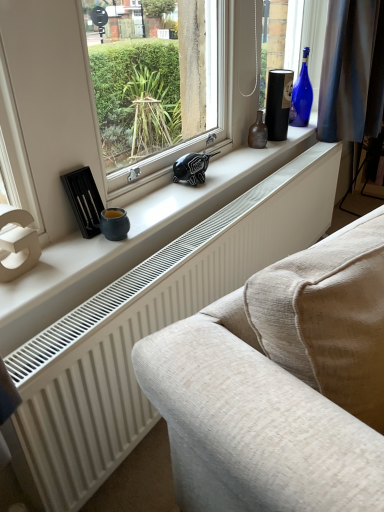
Question: Is blue glass bottle at upper right, the 2th bottle in the front-to-back sequence, at the right side of brown glass bottle at center, the 1th bottle in the left-to-right sequence?

Choices:
 (A) no
 (B) yes

Answer: (B)

Question: From a real-world perspective, is blue glass bottle at upper right, positioned as the first bottle in top-to-bottom order, beneath brown glass bottle at center, the 2th bottle in the back-to-front sequence?

Choices:
 (A) yes
 (B) no

Answer: (B)

Question: Considering the relative sizes of blue glass bottle at upper right, positioned as the first bottle in top-to-bottom order, and brown glass bottle at center, the 1th bottle in the left-to-right sequence, in the image provided, is blue glass bottle at upper right, positioned as the first bottle in top-to-bottom order, smaller than brown glass bottle at center, the 1th bottle in the left-to-right sequence,?

Choices:
 (A) no
 (B) yes

Answer: (A)

Question: Can you confirm if blue glass bottle at upper right, the 1th bottle in the back-to-front sequence, is positioned to the left of brown glass bottle at center, placed as the 1th bottle when sorted from bottom to top?

Choices:
 (A) no
 (B) yes

Answer: (A)

Question: Does blue glass bottle at upper right, the 2th bottle in the front-to-back sequence, contain brown glass bottle at center, arranged as the 2th bottle when viewed from the top?

Choices:
 (A) yes
 (B) no

Answer: (B)

Question: From the image's perspective, is brown glass bottle at center, the first bottle from the front, positioned above or below white matte window sill at center?

Choices:
 (A) below
 (B) above

Answer: (B)

Question: From a real-world perspective, relative to white matte window sill at center, is brown glass bottle at center, positioned as the second bottle in right-to-left order, vertically above or below?

Choices:
 (A) below
 (B) above

Answer: (B)

Question: Would you say brown glass bottle at center, arranged as the 2th bottle when viewed from the top, is to the left or to the right of white matte window sill at center in the picture?

Choices:
 (A) right
 (B) left

Answer: (A)

Question: In terms of width, does brown glass bottle at center, arranged as the 2th bottle when viewed from the top, look wider or thinner when compared to white matte window sill at center?

Choices:
 (A) thin
 (B) wide

Answer: (A)

Question: Considering the positions of white textured radiator at lower center and blue glass bottle at upper right, the 2th bottle in the front-to-back sequence, in the image, is white textured radiator at lower center taller or shorter than blue glass bottle at upper right, the 2th bottle in the front-to-back sequence,?

Choices:
 (A) tall
 (B) short

Answer: (A)

Question: Considering their positions, is white textured radiator at lower center located in front of or behind blue glass bottle at upper right, positioned as the first bottle in top-to-bottom order?

Choices:
 (A) front
 (B) behind

Answer: (A)

Question: In terms of size, does white textured radiator at lower center appear bigger or smaller than blue glass bottle at upper right, the 1th bottle in the back-to-front sequence?

Choices:
 (A) big
 (B) small

Answer: (A)

Question: Do you think white textured radiator at lower center is within blue glass bottle at upper right, the 2th bottle from the left, or outside of it?

Choices:
 (A) inside
 (B) outside

Answer: (B)

Question: Is point (304, 98) positioned closer to the camera than point (43, 473)?

Choices:
 (A) closer
 (B) farther

Answer: (B)

Question: In terms of size, does blue glass bottle at upper right, the 1th bottle in the back-to-front sequence, appear bigger or smaller than white textured radiator at lower center?

Choices:
 (A) small
 (B) big

Answer: (A)